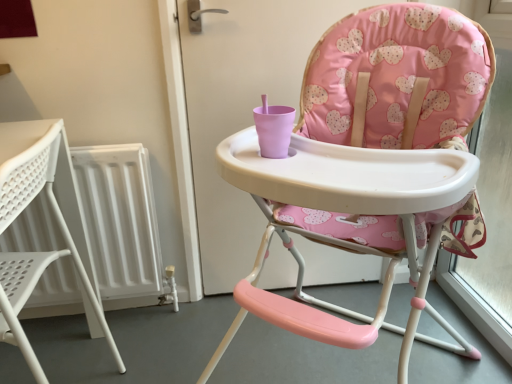
The width and height of the screenshot is (512, 384). What do you see at coordinates (19, 214) in the screenshot?
I see `white plastic chair at left, which ranks as the first chair in left-to-right order` at bounding box center [19, 214].

Where is `white plastic chair at left, the second chair in the right-to-left sequence`? white plastic chair at left, the second chair in the right-to-left sequence is located at coordinates (19, 214).

What is the approximate width of white plastic chair at left, the second chair in the right-to-left sequence?

14.39 inches.

You are a GUI agent. You are given a task and a screenshot of the screen. Output one action in this format:
    pyautogui.click(x=<x>, y=<y>)
    Task: Click on the pink fabric highchair at center, the first chair when ordered from right to left
    
    Given the screenshot: What is the action you would take?
    pyautogui.click(x=395, y=81)

Image resolution: width=512 pixels, height=384 pixels. Describe the element at coordinates (395, 81) in the screenshot. I see `pink fabric highchair at center, placed as the 2th chair when sorted from left to right` at that location.

At what (x,y) coordinates should I click in order to perform the action: click on white plastic chair at left, which ranks as the first chair in left-to-right order. Please return your answer as a coordinate pair (x, y). Image resolution: width=512 pixels, height=384 pixels. Looking at the image, I should click on (19, 214).

Considering the relative positions of white plastic chair at left, which ranks as the first chair in left-to-right order, and pink fabric highchair at center, placed as the 2th chair when sorted from left to right, in the image provided, is white plastic chair at left, which ranks as the first chair in left-to-right order, to the left of pink fabric highchair at center, placed as the 2th chair when sorted from left to right, from the viewer's perspective?

Indeed, white plastic chair at left, which ranks as the first chair in left-to-right order, is positioned on the left side of pink fabric highchair at center, placed as the 2th chair when sorted from left to right.

Is the depth of white plastic chair at left, which ranks as the first chair in left-to-right order, greater than that of pink fabric highchair at center, placed as the 2th chair when sorted from left to right?

Yes, it is.

Is point (22, 345) behind point (265, 179)?

Yes, it is.

From the image's perspective, is white plastic chair at left, which ranks as the first chair in left-to-right order, above pink fabric highchair at center, placed as the 2th chair when sorted from left to right?

No, from the image's perspective, white plastic chair at left, which ranks as the first chair in left-to-right order, is not on top of pink fabric highchair at center, placed as the 2th chair when sorted from left to right.

From a real-world perspective, is white plastic chair at left, the second chair in the right-to-left sequence, under pink fabric highchair at center, placed as the 2th chair when sorted from left to right?

Yes, from a real-world perspective, white plastic chair at left, the second chair in the right-to-left sequence, is under pink fabric highchair at center, placed as the 2th chair when sorted from left to right.

Looking at their sizes, would you say white plastic chair at left, the second chair in the right-to-left sequence, is wider or thinner than pink fabric highchair at center, placed as the 2th chair when sorted from left to right?

Considering their sizes, white plastic chair at left, the second chair in the right-to-left sequence, looks slimmer than pink fabric highchair at center, placed as the 2th chair when sorted from left to right.

Considering the relative sizes of white plastic chair at left, which ranks as the first chair in left-to-right order, and pink fabric highchair at center, placed as the 2th chair when sorted from left to right, in the image provided, is white plastic chair at left, which ranks as the first chair in left-to-right order, taller than pink fabric highchair at center, placed as the 2th chair when sorted from left to right,?

In fact, white plastic chair at left, which ranks as the first chair in left-to-right order, may be shorter than pink fabric highchair at center, placed as the 2th chair when sorted from left to right.

Does white plastic chair at left, which ranks as the first chair in left-to-right order, have a larger size compared to pink fabric highchair at center, placed as the 2th chair when sorted from left to right?

No.

Is white plastic chair at left, which ranks as the first chair in left-to-right order, situated inside pink fabric highchair at center, placed as the 2th chair when sorted from left to right, or outside?

white plastic chair at left, which ranks as the first chair in left-to-right order, is outside pink fabric highchair at center, placed as the 2th chair when sorted from left to right.

In the scene shown: Would you consider white plastic chair at left, the second chair in the right-to-left sequence, to be distant from pink fabric highchair at center, placed as the 2th chair when sorted from left to right?

No, there isn't a large distance between white plastic chair at left, the second chair in the right-to-left sequence, and pink fabric highchair at center, placed as the 2th chair when sorted from left to right.

Is pink fabric highchair at center, placed as the 2th chair when sorted from left to right, at the back of white plastic chair at left, which ranks as the first chair in left-to-right order?

Yes, white plastic chair at left, which ranks as the first chair in left-to-right order, is positioned with its back facing pink fabric highchair at center, placed as the 2th chair when sorted from left to right.

You are a GUI agent. You are given a task and a screenshot of the screen. Output one action in this format:
    pyautogui.click(x=<x>, y=<y>)
    Task: Click on the chair lying below the pink fabric highchair at center, the first chair when ordered from right to left (from the image's perspective)
    
    Given the screenshot: What is the action you would take?
    pyautogui.click(x=19, y=214)

Based on the photo, which is more to the right, pink fabric highchair at center, the first chair when ordered from right to left, or white plastic chair at left, the second chair in the right-to-left sequence?

pink fabric highchair at center, the first chair when ordered from right to left, is more to the right.

Is pink fabric highchair at center, the first chair when ordered from right to left, positioned behind white plastic chair at left, which ranks as the first chair in left-to-right order?

No, pink fabric highchair at center, the first chair when ordered from right to left, is closer to the viewer.

Which point is more distant from viewer, (416, 213) or (10, 163)?

Point (10, 163)

From the image's perspective, which is above, pink fabric highchair at center, the first chair when ordered from right to left, or white plastic chair at left, the second chair in the right-to-left sequence?

pink fabric highchair at center, the first chair when ordered from right to left, appears higher in the image.

From a real-world perspective, is pink fabric highchair at center, the first chair when ordered from right to left, physically below white plastic chair at left, the second chair in the right-to-left sequence?

No, from a real-world perspective, pink fabric highchair at center, the first chair when ordered from right to left, is not under white plastic chair at left, the second chair in the right-to-left sequence.

Is pink fabric highchair at center, placed as the 2th chair when sorted from left to right, thinner than white plastic chair at left, which ranks as the first chair in left-to-right order?

Incorrect, the width of pink fabric highchair at center, placed as the 2th chair when sorted from left to right, is not less than that of white plastic chair at left, which ranks as the first chair in left-to-right order.

Considering the relative sizes of pink fabric highchair at center, placed as the 2th chair when sorted from left to right, and white plastic chair at left, which ranks as the first chair in left-to-right order, in the image provided, is pink fabric highchair at center, placed as the 2th chair when sorted from left to right, shorter than white plastic chair at left, which ranks as the first chair in left-to-right order,?

In fact, pink fabric highchair at center, placed as the 2th chair when sorted from left to right, may be taller than white plastic chair at left, which ranks as the first chair in left-to-right order.

In terms of size, does pink fabric highchair at center, the first chair when ordered from right to left, appear bigger or smaller than white plastic chair at left, which ranks as the first chair in left-to-right order?

Considering their sizes, pink fabric highchair at center, the first chair when ordered from right to left, takes up more space than white plastic chair at left, which ranks as the first chair in left-to-right order.

In the scene shown: Is pink fabric highchair at center, the first chair when ordered from right to left, inside the boundaries of white plastic chair at left, the second chair in the right-to-left sequence, or outside?

pink fabric highchair at center, the first chair when ordered from right to left, is outside white plastic chair at left, the second chair in the right-to-left sequence.

Is pink fabric highchair at center, the first chair when ordered from right to left, not close to white plastic chair at left, which ranks as the first chair in left-to-right order?

They are positioned close to each other.

Is white plastic chair at left, which ranks as the first chair in left-to-right order, at the back of pink fabric highchair at center, the first chair when ordered from right to left?

No, white plastic chair at left, which ranks as the first chair in left-to-right order, is not at the back of pink fabric highchair at center, the first chair when ordered from right to left.

Consider the image. How many degrees apart are the facing directions of pink fabric highchair at center, placed as the 2th chair when sorted from left to right, and white plastic chair at left, the second chair in the right-to-left sequence?

Result: pink fabric highchair at center, placed as the 2th chair when sorted from left to right, and white plastic chair at left, the second chair in the right-to-left sequence, are facing 48.1 degrees away from each other.

Locate an element on the screen. The width and height of the screenshot is (512, 384). chair in front of the white plastic chair at left, which ranks as the first chair in left-to-right order is located at coordinates (395, 81).

Locate an element on the screen. The image size is (512, 384). chair that is under the pink fabric highchair at center, placed as the 2th chair when sorted from left to right (from a real-world perspective) is located at coordinates (19, 214).

Locate an element on the screen. The height and width of the screenshot is (384, 512). chair in front of the white plastic chair at left, which ranks as the first chair in left-to-right order is located at coordinates (395, 81).